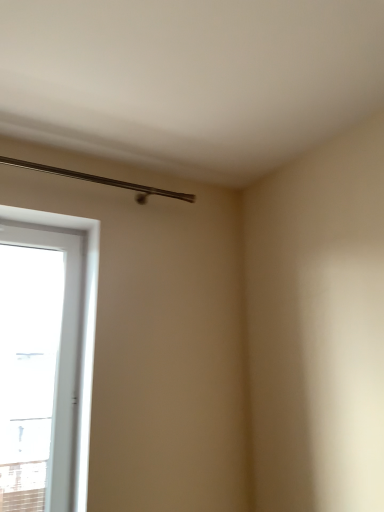
Where is `transparent glass window at left`? The width and height of the screenshot is (384, 512). transparent glass window at left is located at coordinates (83, 330).

This screenshot has width=384, height=512. Describe the element at coordinates (83, 330) in the screenshot. I see `transparent glass window at left` at that location.

Where is `transparent glass window at left`? The height and width of the screenshot is (512, 384). transparent glass window at left is located at coordinates (83, 330).